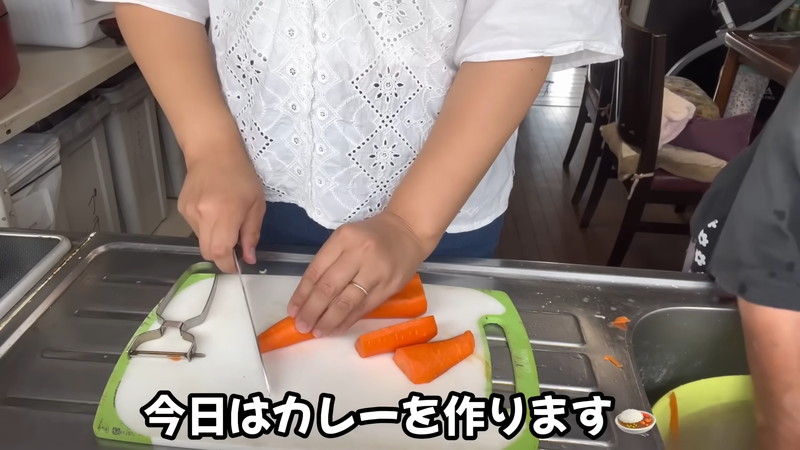
What are the coordinates of `chopping board` in the screenshot? It's located at (226, 369).